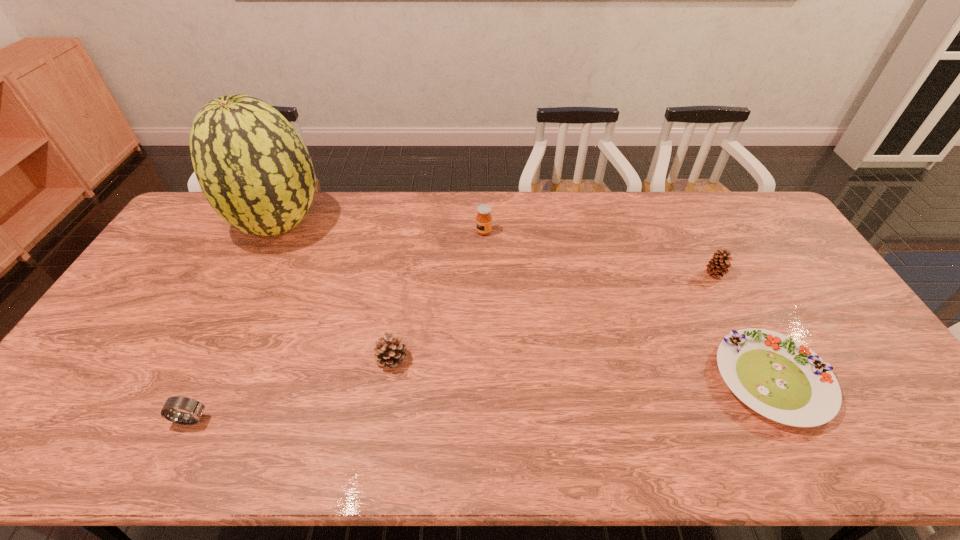
What are the coordinates of `free space that is in between the fourth object from right to left and the farther pinecone` in the screenshot? It's located at (554, 316).

The height and width of the screenshot is (540, 960). I want to click on vacant point located between the watermelon and the salad plate, so click(x=526, y=302).

The image size is (960, 540). In order to click on free space between the right pinecone and the left pinecone in this screenshot , I will do `click(554, 316)`.

Locate an element on the screen. The image size is (960, 540). unoccupied area between the salad plate and the watch is located at coordinates (482, 400).

Image resolution: width=960 pixels, height=540 pixels. I want to click on unoccupied position between the left pinecone and the salad plate, so click(583, 369).

What are the coordinates of `vacant area that lies between the third object from right to left and the tallest object` in the screenshot? It's located at (381, 228).

This screenshot has height=540, width=960. In order to click on free point between the salad plate and the watch in this screenshot , I will do `click(482, 400)`.

Identify which object is the second closest to the tallest object. Please provide its 2D coordinates. Your answer should be formatted as a tuple, i.e. [(x, y)], where the tuple contains the x and y coordinates of a point satisfying the conditions above.

[(483, 219)]

Point out which object is positioned as the third nearest to the tallest object. Please provide its 2D coordinates. Your answer should be formatted as a tuple, i.e. [(x, y)], where the tuple contains the x and y coordinates of a point satisfying the conditions above.

[(196, 408)]

Identify the location of free spot that satisfies the following two spatial constraints: 1. on the front side of the shortest object; 2. on the left side of the nearer pinecone. (389, 380).